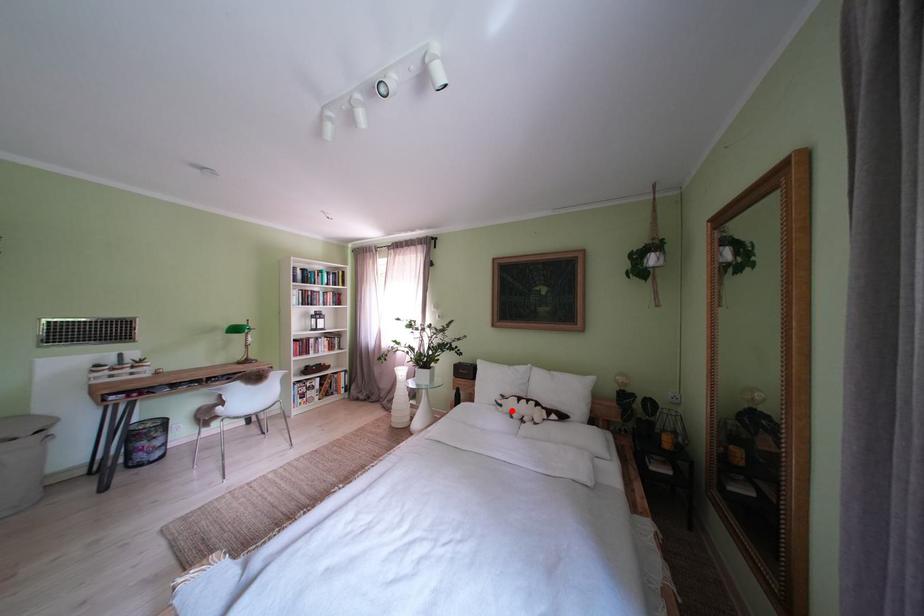
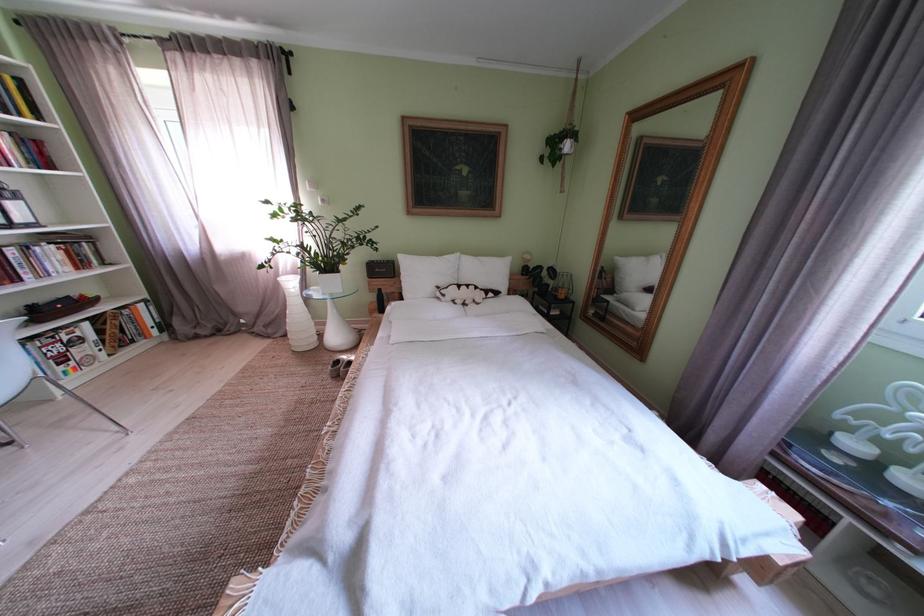
In the second image, find the point that corresponds to the highlighted location in the first image.

(455, 301)